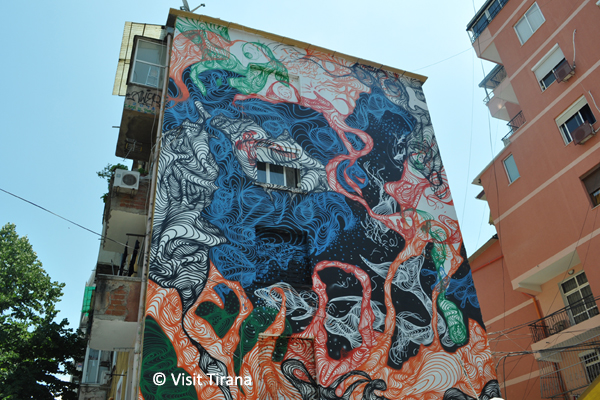
Locate an element on the screen. The height and width of the screenshot is (400, 600). patio walls is located at coordinates [578, 308], [584, 380], [109, 296], [134, 196], [491, 100], [518, 119], [507, 140], [485, 26].